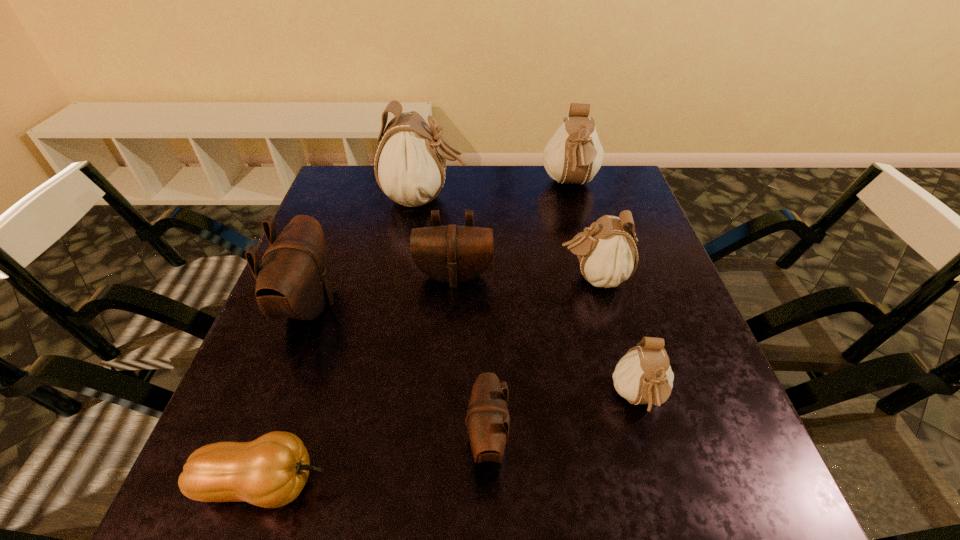
The width and height of the screenshot is (960, 540). Find the location of `free location located with the flap open on the nearest brown pouch`. free location located with the flap open on the nearest brown pouch is located at coordinates (253, 438).

You are a GUI agent. You are given a task and a screenshot of the screen. Output one action in this format:
    pyautogui.click(x=<x>, y=<y>)
    Task: Click on the free space located 0.350m on the stem side of the gourd
    
    Given the screenshot: What is the action you would take?
    pyautogui.click(x=553, y=484)

At what (x,y) coordinates should I click in order to perform the action: click on pouch situated at the near edge. Please return your answer as a coordinate pair (x, y). The height and width of the screenshot is (540, 960). Looking at the image, I should click on (488, 421).

Where is `gourd that is positioned at the near edge`? gourd that is positioned at the near edge is located at coordinates (271, 471).

Locate an element on the screen. The image size is (960, 540). pouch that is at the left edge is located at coordinates (293, 281).

Find the location of a particular element. The width and height of the screenshot is (960, 540). gourd that is positioned at the left edge is located at coordinates (271, 471).

Where is `object that is at the near left corner`? This screenshot has height=540, width=960. object that is at the near left corner is located at coordinates (271, 471).

What are the coordinates of `object at the far right corner` in the screenshot? It's located at tap(574, 154).

Image resolution: width=960 pixels, height=540 pixels. In the image, there is a desktop. What are the coordinates of `free region at the far edge` in the screenshot? It's located at (509, 165).

At what (x,y) coordinates should I click in order to perform the action: click on free space at the left edge. Please return your answer as a coordinate pair (x, y). The height and width of the screenshot is (540, 960). Looking at the image, I should click on (334, 251).